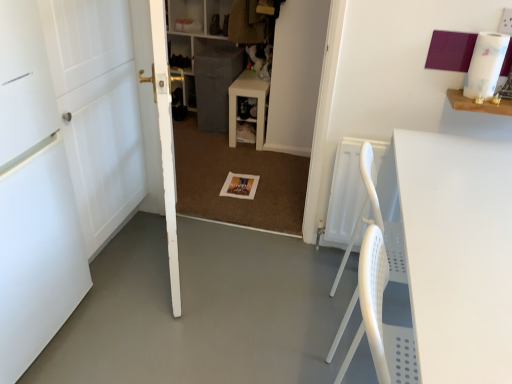
Find the location of `free space in front of white wooden door at left, which is counted as the 1th door, starting from the right`. free space in front of white wooden door at left, which is counted as the 1th door, starting from the right is located at coordinates (165, 327).